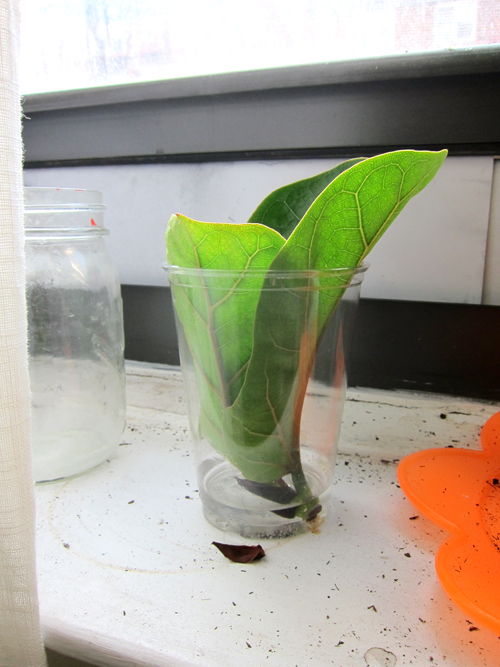
Where is `white wall`? Image resolution: width=500 pixels, height=667 pixels. white wall is located at coordinates (456, 259).